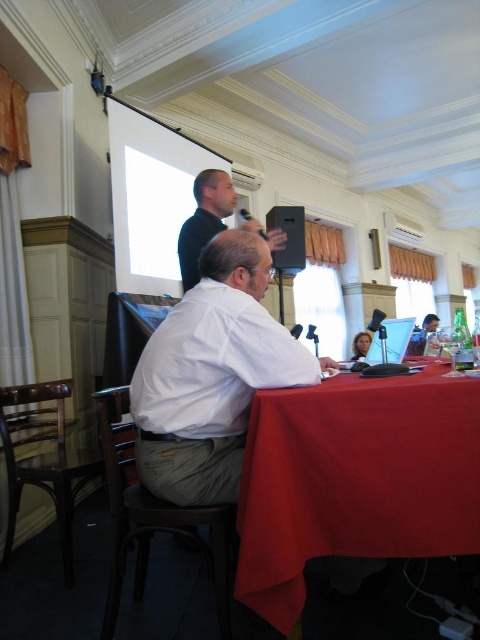
You are organizing a photo shoot in this conference room and need to ensure that two shirts, the white cotton shirt at center and the black matte shirt at upper center, are spaced exactly 36 inches apart. Based on the scene description, will their current positioning meet this requirement?

The distance between the white cotton shirt at center and the black matte shirt at upper center is 36.07 inches, which is slightly more than the required 36 inches. Adjusting them by 0.07 inches would meet the exact requirement.

You are standing at the entrance of the conference room. You need to locate the red cloth table at lower center. According to the coordinates provided, where should you look to find it?

The red cloth table at lower center is located at point coordinates of 0.750 on the x axis and 0.740 on the y axis.

You are standing in the conference room and need to place a 0.5 meter wide laptop bag on the table. Given the table is at position 0.750, 0.740, can you confirm if there is enough space on the red cloth table at lower center to place the bag?

The question cannot be answered with the provided information because the dimensions of the red cloth table at lower center are not specified in the Objects Description.